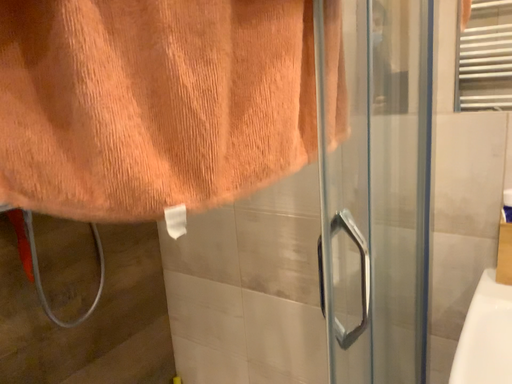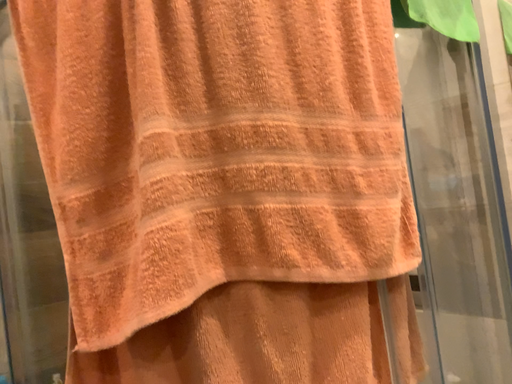
Question: How did the camera likely rotate when shooting the video?

Choices:
 (A) rotated downward
 (B) rotated upward

Answer: (B)